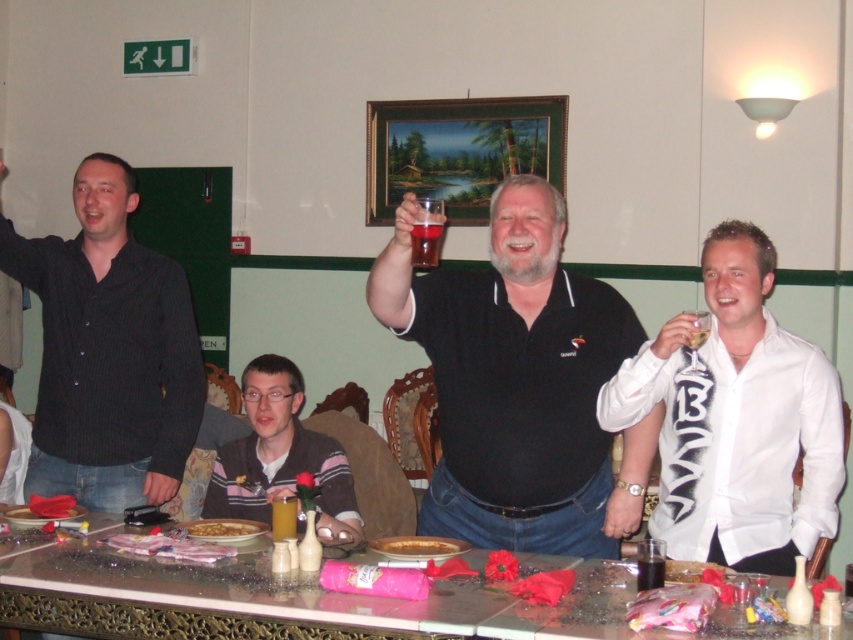
You are a waiter at a restaurant and need to place a new dish on the table. The table has a golden flaky pie at center. Where should you place the new dish to avoid covering the pie?

The golden flaky pie at center is located at point (416, 545), so you should place the new dish away from that coordinate to avoid covering it.

You are a waiter in a restaurant and need to deliver a dessert plate to the table. The dessert plate is quite large and might not fit easily between the white glossy shirt at right and the striped sweater at lower center. Based on their sizes, which of the two items should you avoid placing the dessert plate next to to ensure there is enough space?

The white glossy shirt at right has a smaller size compared to the striped sweater at lower center, so you should avoid placing the dessert plate next to the white glossy shirt at right to ensure there is enough space.